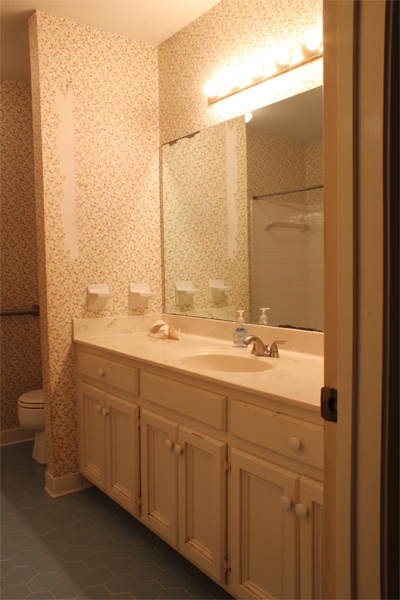
Where is `drawers`? The image size is (400, 600). drawers is located at coordinates (117, 376), (265, 432).